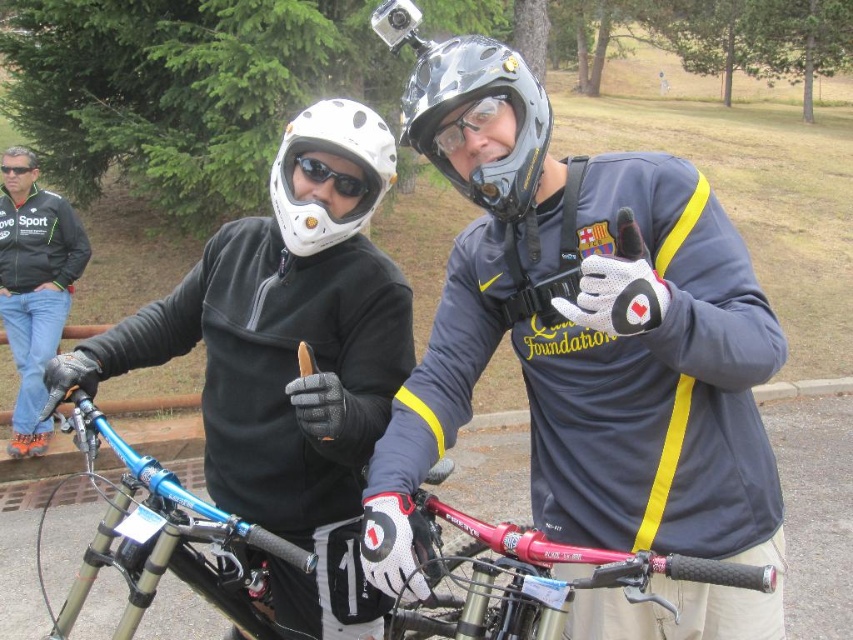
Question: Among these objects, which one is nearest to the camera?

Choices:
 (A) shiny blue frame at center
 (B) matte black helmet at upper left
 (C) transparent plastic goggles at upper center
 (D) black matte goggles at center

Answer: (A)

Question: Can you confirm if matte black helmet at upper center is smaller than transparent plastic goggles at upper center?

Choices:
 (A) yes
 (B) no

Answer: (B)

Question: From the image, what is the correct spatial relationship of transparent plastic goggles at upper center in relation to black matte goggles at upper left?

Choices:
 (A) right
 (B) left

Answer: (A)

Question: Which object is positioned farthest from the black matte helmet at center?

Choices:
 (A) black matte goggles at center
 (B) matte black helmet at upper left

Answer: (B)

Question: Which object is the farthest from the black matte goggles at upper left?

Choices:
 (A) matte black helmet at upper center
 (B) black matte goggles at center
 (C) matte black helmet at upper left
 (D) black leather jacket at upper left

Answer: (A)

Question: Is matte black helmet at upper center closer to camera compared to matte black helmet at upper left?

Choices:
 (A) no
 (B) yes

Answer: (B)